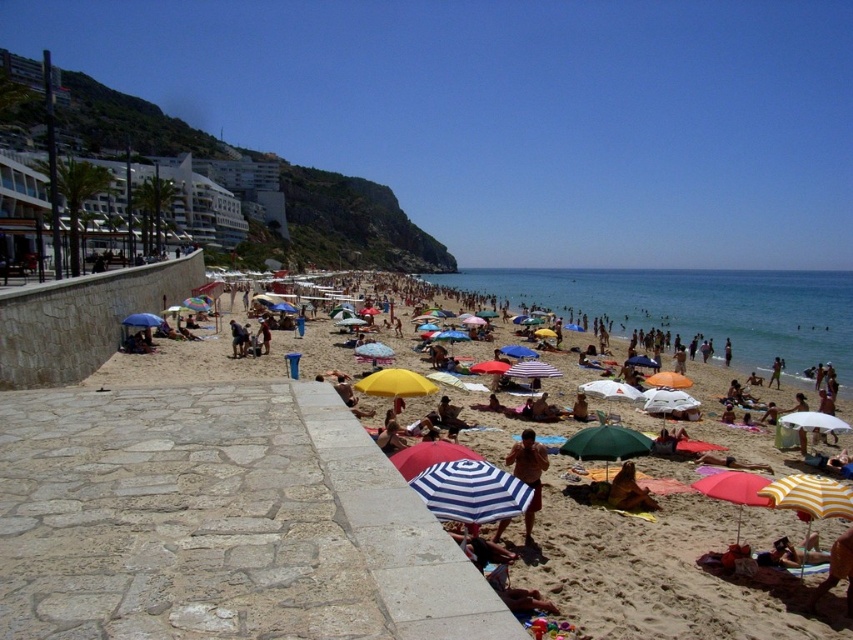
Does blue and white striped umbrella at lower center appear on the right side of tan skin person at center?

Incorrect, blue and white striped umbrella at lower center is not on the right side of tan skin person at center.

Is point (492, 476) farther from camera compared to point (544, 467)?

No, (492, 476) is in front of (544, 467).

Image resolution: width=853 pixels, height=640 pixels. What are the coordinates of `blue and white striped umbrella at lower center` in the screenshot? It's located at (471, 492).

Can you confirm if tan skin person at center is wider than red fabric umbrella at lower right?

No, tan skin person at center is not wider than red fabric umbrella at lower right.

This screenshot has height=640, width=853. Describe the element at coordinates (527, 472) in the screenshot. I see `tan skin person at center` at that location.

Find the location of `tan skin person at center`. tan skin person at center is located at coordinates (527, 472).

Which of these two, green fabric umbrella at center or dark brown leather jacket at center, stands shorter?

green fabric umbrella at center is shorter.

Does point (631, 429) lie in front of point (231, 337)?

Yes, it is in front of point (231, 337).

Measure the distance between point (613, 460) and camera.

Point (613, 460) is 26.46 meters from camera.

Find the location of `green fabric umbrella at center`. green fabric umbrella at center is located at coordinates (606, 444).